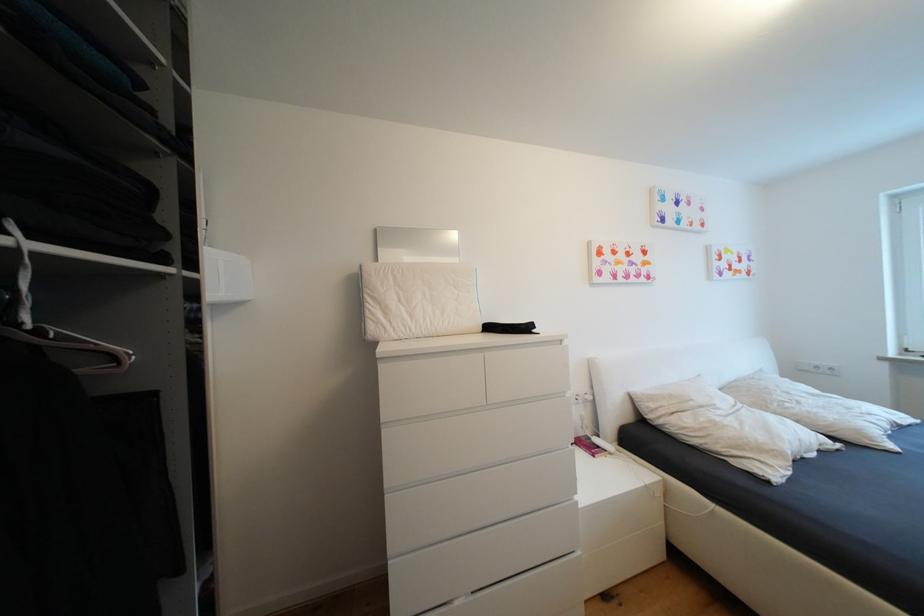
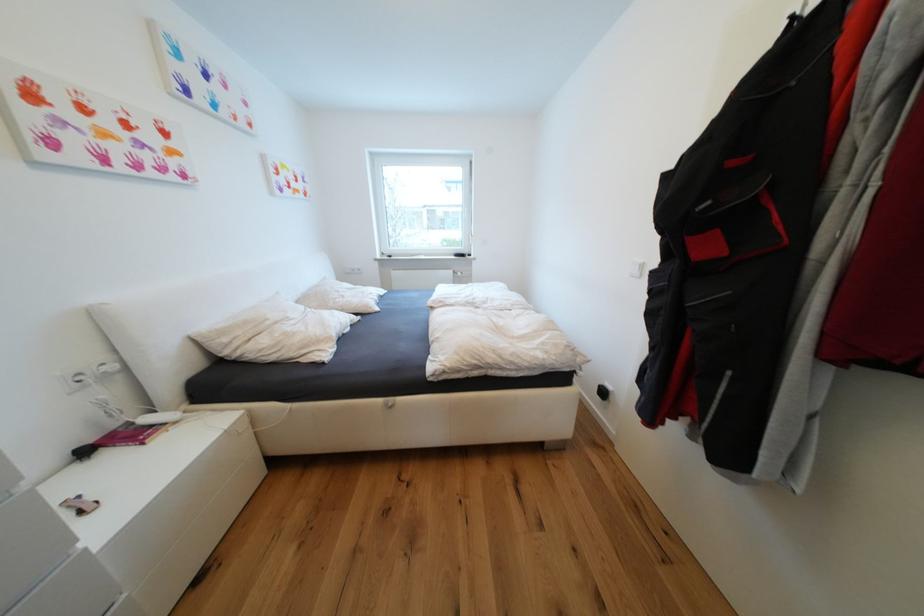
In the second image, find the point that corresponds to the point at 597,399 in the first image.

(119, 369)